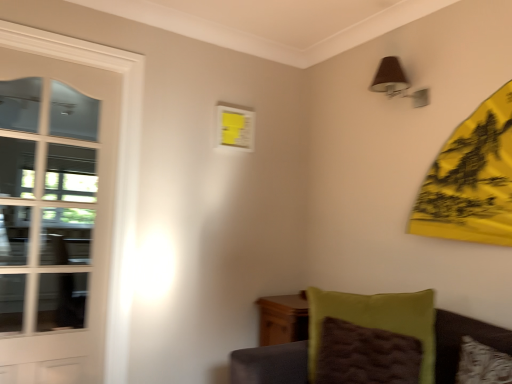
Question: Is white glossy door at left at the left side of green fuzzy pillow at lower right?

Choices:
 (A) no
 (B) yes

Answer: (B)

Question: Is white glossy door at left smaller than green fuzzy pillow at lower right?

Choices:
 (A) yes
 (B) no

Answer: (B)

Question: Does white glossy door at left have a larger size compared to green fuzzy pillow at lower right?

Choices:
 (A) yes
 (B) no

Answer: (A)

Question: Is green fuzzy pillow at lower right at the back of white glossy door at left?

Choices:
 (A) no
 (B) yes

Answer: (A)

Question: Can you confirm if white glossy door at left is wider than green fuzzy pillow at lower right?

Choices:
 (A) yes
 (B) no

Answer: (B)

Question: Looking at the image, does velvet green cushion at lower right seem bigger or smaller compared to green fuzzy pillow at lower right?

Choices:
 (A) small
 (B) big

Answer: (B)

Question: Does point (241, 355) appear closer or farther from the camera than point (428, 332)?

Choices:
 (A) farther
 (B) closer

Answer: (B)

Question: In terms of height, does velvet green cushion at lower right look taller or shorter compared to green fuzzy pillow at lower right?

Choices:
 (A) tall
 (B) short

Answer: (A)

Question: Based on their positions, is velvet green cushion at lower right located to the left or right of green fuzzy pillow at lower right?

Choices:
 (A) right
 (B) left

Answer: (A)

Question: From a real-world perspective, is white glossy door at left above or below green fuzzy pillow at lower right?

Choices:
 (A) below
 (B) above

Answer: (B)

Question: Is white glossy door at left taller or shorter than green fuzzy pillow at lower right?

Choices:
 (A) tall
 (B) short

Answer: (A)

Question: From the image's perspective, is white glossy door at left located above or below green fuzzy pillow at lower right?

Choices:
 (A) above
 (B) below

Answer: (A)

Question: In the image, is white glossy door at left on the left side or the right side of green fuzzy pillow at lower right?

Choices:
 (A) right
 (B) left

Answer: (B)

Question: Is green fuzzy pillow at lower right wider or thinner than velvet green cushion at lower right?

Choices:
 (A) thin
 (B) wide

Answer: (A)

Question: Does point (380, 365) appear closer or farther from the camera than point (437, 327)?

Choices:
 (A) farther
 (B) closer

Answer: (B)